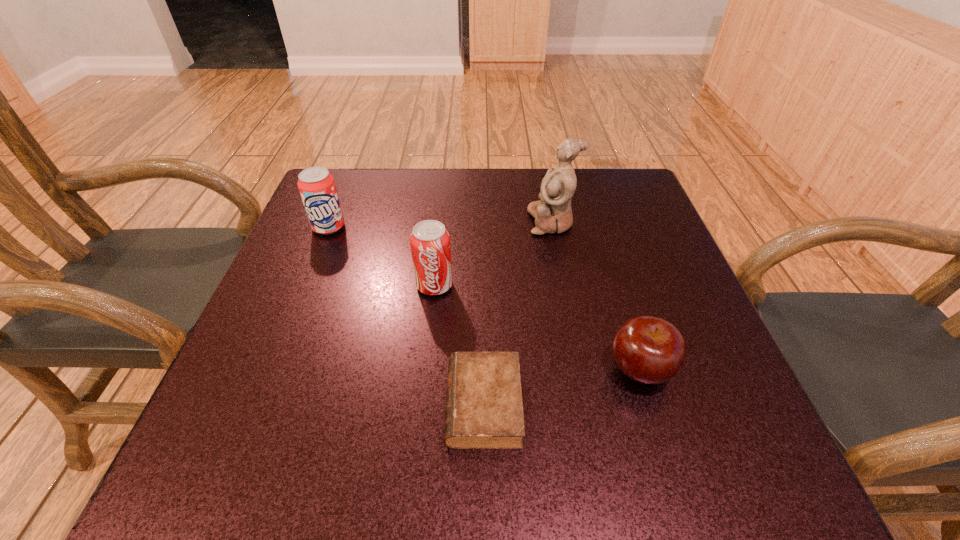
This screenshot has height=540, width=960. What are the coordinates of `the tallest object` in the screenshot? It's located at (552, 213).

The height and width of the screenshot is (540, 960). In order to click on the nearer soda can in this screenshot , I will do `click(430, 242)`.

Image resolution: width=960 pixels, height=540 pixels. Identify the location of the fourth object from right to left. (430, 242).

The width and height of the screenshot is (960, 540). Identify the location of the left soda can. (317, 187).

In order to click on the leftmost object in this screenshot , I will do `click(317, 187)`.

Locate an element on the screen. the second shortest object is located at coordinates (649, 350).

You are a GUI agent. You are given a task and a screenshot of the screen. Output one action in this format:
    pyautogui.click(x=<x>, y=<y>)
    Task: Click on the diary
    
    Given the screenshot: What is the action you would take?
    pyautogui.click(x=484, y=410)

I want to click on the third object from right to left, so click(x=484, y=410).

You are a GUI agent. You are given a task and a screenshot of the screen. Output one action in this format:
    pyautogui.click(x=<x>, y=<y>)
    Task: Click on the free space located on the front-facing side of the tallest object
    Image resolution: width=960 pixels, height=540 pixels.
    Given the screenshot: What is the action you would take?
    pyautogui.click(x=499, y=222)

At what (x,y) coordinates should I click in order to perform the action: click on vacant region located on the front-facing side of the tallest object. Please return your answer as a coordinate pair (x, y). Looking at the image, I should click on (415, 222).